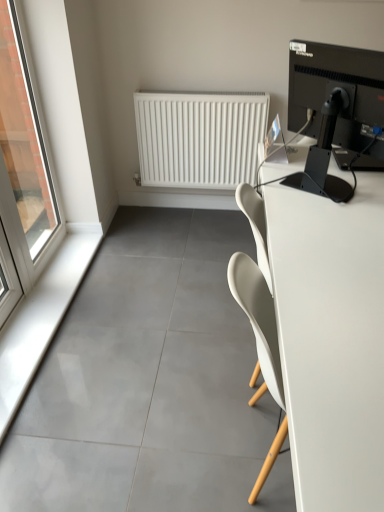
The image size is (384, 512). What do you see at coordinates (199, 138) in the screenshot?
I see `white matte radiator at upper center` at bounding box center [199, 138].

Describe the element at coordinates (40, 320) in the screenshot. The height and width of the screenshot is (512, 384). I see `white glossy window sill at lower left` at that location.

This screenshot has height=512, width=384. Describe the element at coordinates (25, 158) in the screenshot. I see `transparent glass window at left` at that location.

Measure the distance between black glossy monitor at upper right and camera.

black glossy monitor at upper right and camera are 4.53 feet apart.

Find the location of a particular element. The width and height of the screenshot is (384, 512). white matte radiator at upper center is located at coordinates (199, 138).

Who is smaller, white matte radiator at upper center or transparent glass window at left?

Smaller between the two is white matte radiator at upper center.

Do you think white matte radiator at upper center is within transparent glass window at left, or outside of it?

white matte radiator at upper center lies outside transparent glass window at left.

Are white matte radiator at upper center and transparent glass window at left located far from each other?

They are positioned close to each other.

Is white matte radiator at upper center facing towards transparent glass window at left?

No, white matte radiator at upper center is not facing towards transparent glass window at left.

I want to click on desk on the right side of transparent glass window at left, so click(x=331, y=340).

From the image's perspective, between transparent glass window at left and white matte desk at right, who is located below?

white matte desk at right is shown below in the image.

What's the angular difference between transparent glass window at left and white matte desk at right's facing directions?

0.00194 degrees separate the facing orientations of transparent glass window at left and white matte desk at right.

Does white matte desk at right have a lesser height compared to white glossy window sill at lower left?

In fact, white matte desk at right may be taller than white glossy window sill at lower left.

Is point (373, 423) less distant than point (30, 362)?

That is True.

Is white matte desk at right bigger or smaller than white glossy window sill at lower left?

In the image, white matte desk at right appears to be larger than white glossy window sill at lower left.

Is transparent glass window at left facing away from white glossy window sill at lower left?

No, transparent glass window at left's orientation is not away from white glossy window sill at lower left.

From a real-world perspective, who is located higher, transparent glass window at left or white glossy window sill at lower left?

transparent glass window at left.

Choose the correct answer: Is transparent glass window at left inside white glossy window sill at lower left or outside it?

transparent glass window at left is not enclosed by white glossy window sill at lower left.

From the image's perspective, is transparent glass window at left positioned above or below black glossy monitor at upper right?

transparent glass window at left is above black glossy monitor at upper right.

Is transparent glass window at left aimed at black glossy monitor at upper right?

Yes, transparent glass window at left is turned towards black glossy monitor at upper right.

Can you see transparent glass window at left touching black glossy monitor at upper right?

No, transparent glass window at left is not in contact with black glossy monitor at upper right.

Who is taller, white matte desk at right or transparent glass window at left?

Standing taller between the two is transparent glass window at left.

Between point (347, 389) and point (22, 19), which one is positioned behind?

The point (22, 19) is behind.

Is white matte desk at right in front of or behind transparent glass window at left in the image?

Clearly, white matte desk at right is in front of transparent glass window at left.

Does transparent glass window at left appear on the right side of white matte radiator at upper center?

Incorrect, transparent glass window at left is not on the right side of white matte radiator at upper center.

Can you confirm if transparent glass window at left is bigger than white matte radiator at upper center?

Yes, transparent glass window at left is bigger than white matte radiator at upper center.

Looking at this image, which point is more distant from viewer, (5,145) or (250,169)?

Point (250,169)

Image resolution: width=384 pixels, height=512 pixels. I want to click on radiator on the right of transparent glass window at left, so click(199, 138).

Locate an element on the screen. The width and height of the screenshot is (384, 512). desk in front of the transparent glass window at left is located at coordinates (331, 340).

Considering their positions, is white matte desk at right positioned closer to transparent glass window at left than white matte radiator at upper center?

The object closer to transparent glass window at left is white matte radiator at upper center.

Estimate the real-world distances between objects in this image. Which object is closer to white glossy window sill at lower left, white matte desk at right or white matte radiator at upper center?

white matte radiator at upper center lies closer to white glossy window sill at lower left than the other object.

Looking at the image, which one is located further to white glossy window sill at lower left, white matte radiator at upper center or transparent glass window at left?

Among the two, white matte radiator at upper center is located further to white glossy window sill at lower left.

Looking at the image, which one is located further to white matte radiator at upper center, white glossy window sill at lower left or white matte desk at right?

The object further to white matte radiator at upper center is white matte desk at right.

When comparing their distances from white glossy window sill at lower left, does white matte radiator at upper center or white matte desk at right seem closer?

Based on the image, white matte radiator at upper center appears to be nearer to white glossy window sill at lower left.

Looking at the image, which one is located further to transparent glass window at left, white glossy window sill at lower left or black glossy monitor at upper right?

The object further to transparent glass window at left is black glossy monitor at upper right.

Which object lies further to the anchor point white matte radiator at upper center, white matte desk at right or white glossy window sill at lower left?

white matte desk at right is positioned further to the anchor white matte radiator at upper center.

Based on the photo, estimate the real-world distances between objects in this image. Which object is further from white matte desk at right, black glossy monitor at upper right or white glossy window sill at lower left?

white glossy window sill at lower left is further to white matte desk at right.

Where is `radiator between transparent glass window at left and black glossy monitor at upper right in the horizontal direction`? radiator between transparent glass window at left and black glossy monitor at upper right in the horizontal direction is located at coordinates (199, 138).

Locate an element on the screen. This screenshot has width=384, height=512. desktop computer between white matte desk at right and white matte radiator at upper center from front to back is located at coordinates click(334, 109).

You are a GUI agent. You are given a task and a screenshot of the screen. Output one action in this format:
    pyautogui.click(x=<x>, y=<y>)
    Task: Click on the desktop computer located between transparent glass window at left and white matte desk at right in the left-right direction
    This screenshot has width=384, height=512.
    Given the screenshot: What is the action you would take?
    pyautogui.click(x=334, y=109)

Locate an element on the screen. This screenshot has width=384, height=512. desktop computer between white glossy window sill at lower left and white matte desk at right in the horizontal direction is located at coordinates (334, 109).